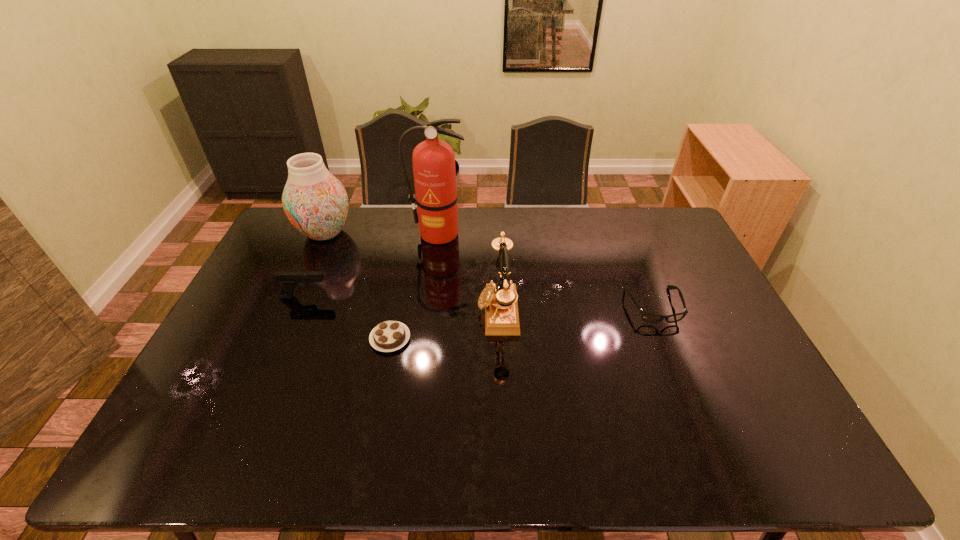
Identify the location of free location located 0.180m on the dial of the telephone. Image resolution: width=960 pixels, height=540 pixels. (419, 310).

At what (x,y) coordinates should I click in order to perform the action: click on free space located 0.240m on the dial of the telephone. Please return your answer as a coordinate pair (x, y). The image size is (960, 540). Looking at the image, I should click on (398, 310).

You are a GUI agent. You are given a task and a screenshot of the screen. Output one action in this format:
    pyautogui.click(x=<x>, y=<y>)
    Task: Click on the blank space located 0.310m on the dial of the telephone
    
    Given the screenshot: What is the action you would take?
    pyautogui.click(x=375, y=310)

Where is `free space located 0.290m on the front-facing side of the pistol`? This screenshot has height=540, width=960. free space located 0.290m on the front-facing side of the pistol is located at coordinates (423, 296).

Where is `blank space located on the front-facing side of the spectacles`? blank space located on the front-facing side of the spectacles is located at coordinates (715, 456).

At what (x,y) coordinates should I click in order to perform the action: click on vacant area situated 0.180m on the right of the chocolate cake. Please return your answer as a coordinate pair (x, y). This screenshot has height=540, width=960. Looking at the image, I should click on (474, 339).

Locate an element on the screen. This screenshot has height=540, width=960. fire extinguisher at the far edge is located at coordinates (434, 170).

In order to click on vase that is at the far edge in this screenshot , I will do `click(316, 203)`.

The height and width of the screenshot is (540, 960). What are the coordinates of `vase positioned at the left edge` in the screenshot? It's located at (316, 203).

I want to click on pistol that is positioned at the left edge, so (289, 280).